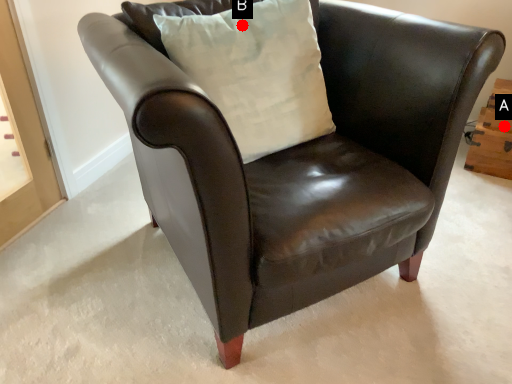
Question: Two points are circled on the image, labeled by A and B beside each circle. Which point is farther to the camera?

Choices:
 (A) A is further
 (B) B is further

Answer: (A)